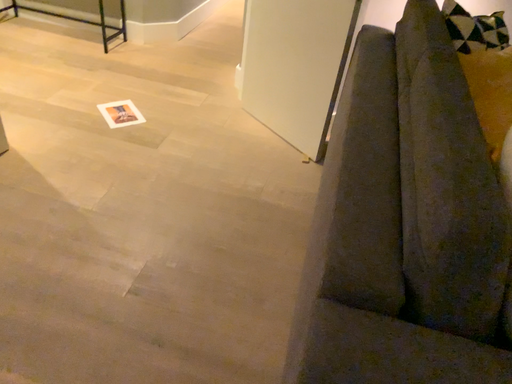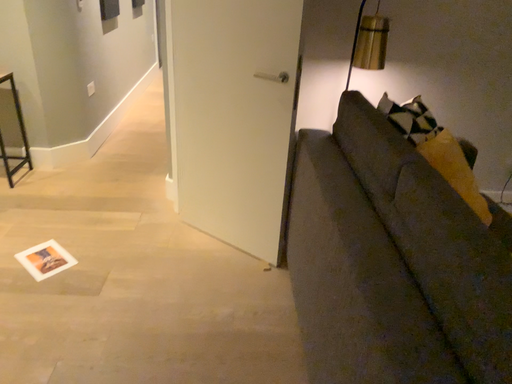
Question: How did the camera likely rotate when shooting the video?

Choices:
 (A) rotated upward
 (B) rotated downward

Answer: (A)